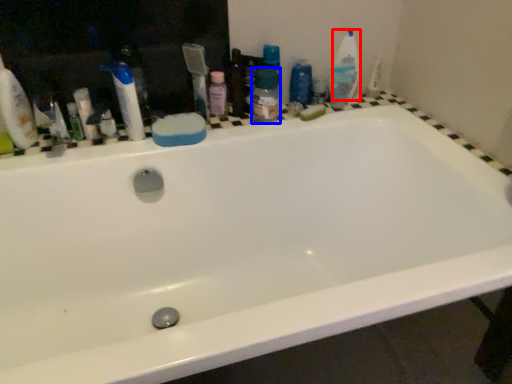
Question: Which point is closer to the camera, cleaning product (highlighted by a red box) or toiletry (highlighted by a blue box)?

Choices:
 (A) cleaning product
 (B) toiletry

Answer: (B)